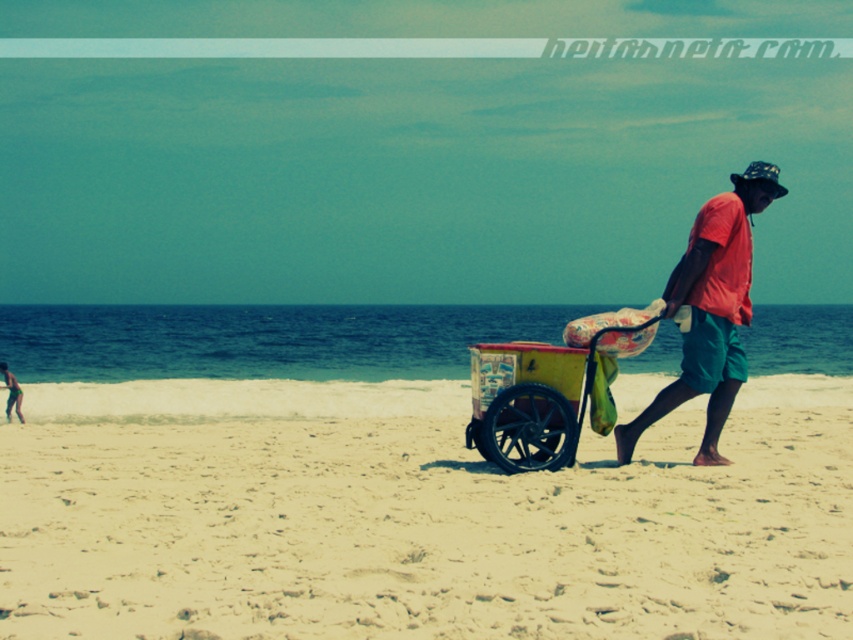
Question: Is beige sandy beach at center in front of red cotton shirt at center?

Choices:
 (A) yes
 (B) no

Answer: (A)

Question: Is beige sandy beach at center below yellow painted wood cart at center?

Choices:
 (A) no
 (B) yes

Answer: (B)

Question: Which point appears closest to the camera in this image?

Choices:
 (A) (640, 316)
 (B) (172, 593)
 (C) (643, 426)

Answer: (B)

Question: Which point appears closest to the camera in this image?

Choices:
 (A) (660, 403)
 (B) (439, 387)
 (C) (538, 426)

Answer: (C)

Question: Which point is closer to the camera?

Choices:
 (A) (704, 456)
 (B) (97, 592)
 (C) (527, 355)

Answer: (B)

Question: Is beige sandy beach at center to the left of yellow painted wood cart at center from the viewer's perspective?

Choices:
 (A) no
 (B) yes

Answer: (A)